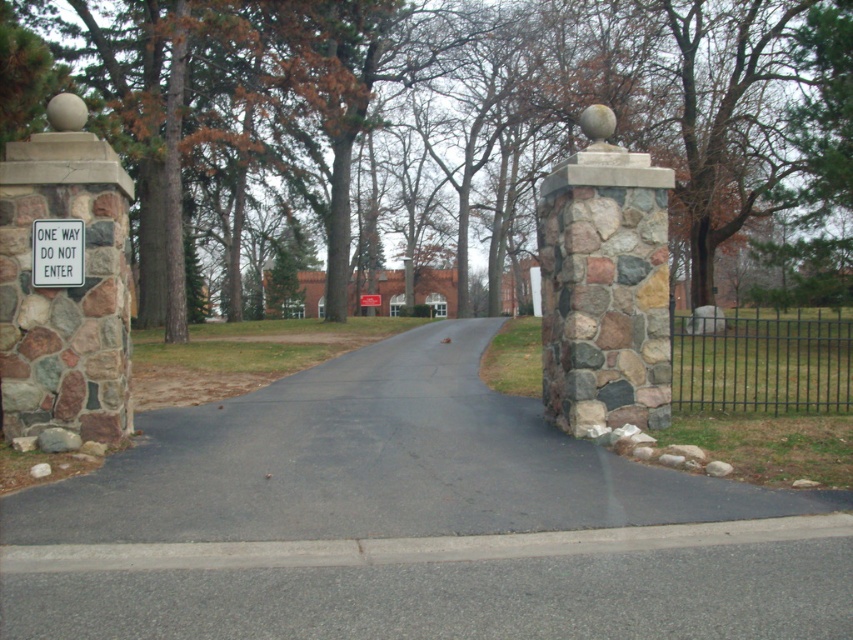
Question: Can you confirm if black asphalt road at center is wider than white plastic sign at center?

Choices:
 (A) yes
 (B) no

Answer: (A)

Question: Where is brown textured tree at upper center located in relation to white paper sign at center in the image?

Choices:
 (A) left
 (B) right

Answer: (B)

Question: Among these objects, which one is farthest from the camera?

Choices:
 (A) brown textured tree at upper center
 (B) white plastic sign at center
 (C) black asphalt road at center

Answer: (A)

Question: Which point appears closest to the camera in this image?

Choices:
 (A) (831, 68)
 (B) (328, 513)
 (C) (366, 301)
 (D) (62, 240)

Answer: (B)

Question: Which object is positioned farthest from the black asphalt road at center?

Choices:
 (A) white paper sign at center
 (B) brown textured tree at upper center
 (C) white plastic sign at center

Answer: (A)

Question: Where is brown textured tree at upper center located in relation to black asphalt road at center in the image?

Choices:
 (A) above
 (B) below

Answer: (A)